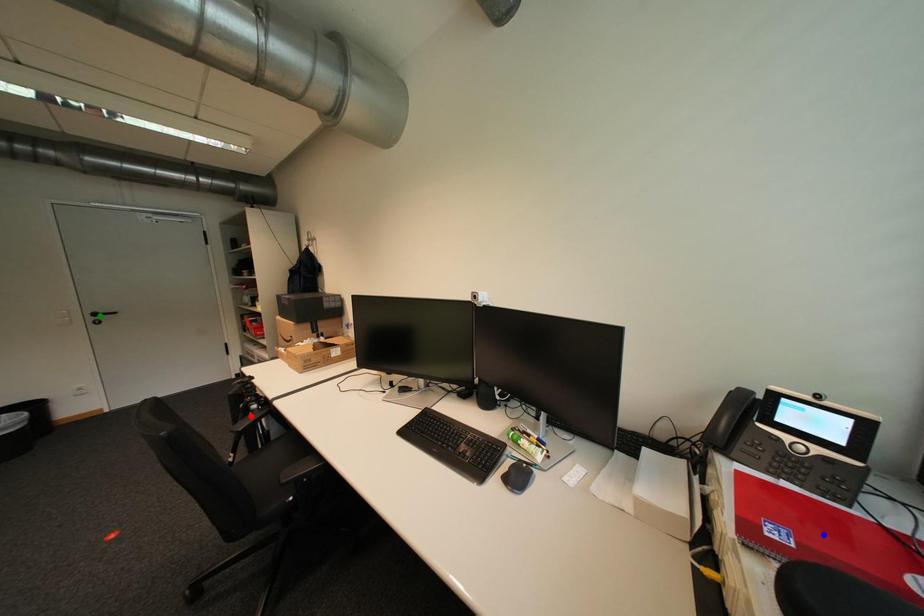
Order these from farthest to nearest:
1. blue point
2. red point
3. green point

green point, red point, blue point